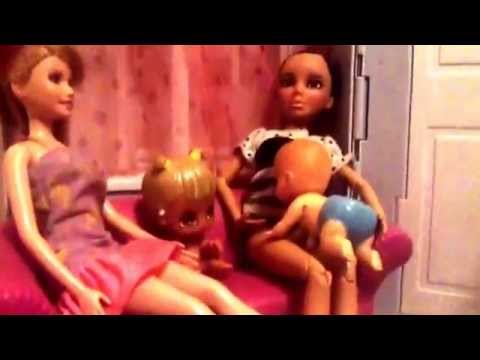
Find the location of a particular element. white door is located at coordinates (441, 141).